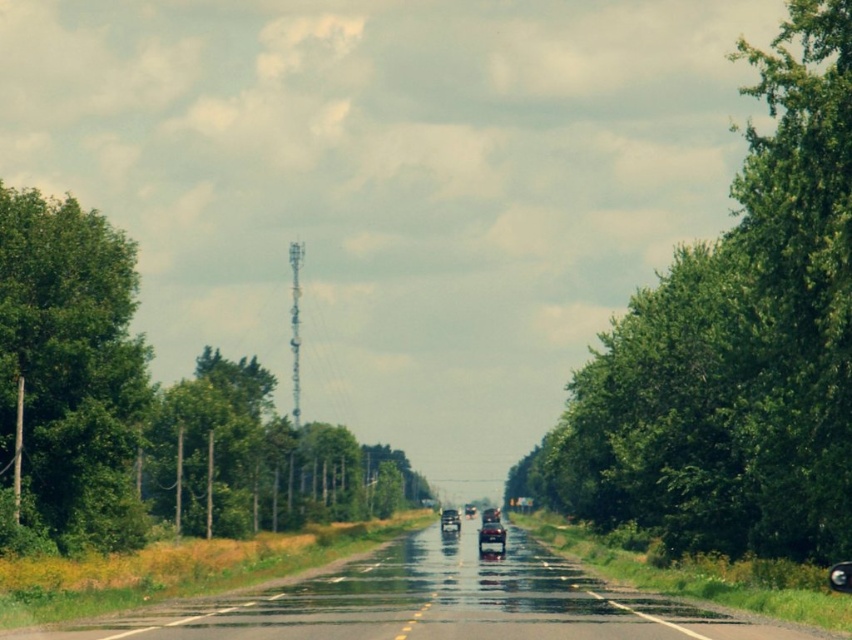
You are driving a car and see two points on the road ahead. The first point is at coordinates point (49,433) and the second is at point (453,509). Which point is closer to your current position?

Point (49,433) is in front of point (453,509), so the first point is closer to your current position.

You are a photographer wanting to capture the shiny silver sedan at center and the green leafy tree at left in the same frame. Since the tree is taller, how might you position your camera to ensure both are fully visible?

The green leafy tree at left is taller than the shiny silver sedan at center. To capture both fully, position the camera lower to include more of the tree canopy while keeping the sedan centered in the frame.

You are a driver approaching the green leafy tree at right and the wet asphalt road at center. Which object will you see first from your driving perspective?

The green leafy tree at right is located above the wet asphalt road at center, so you will see the green leafy tree at right first as you drive towards them.